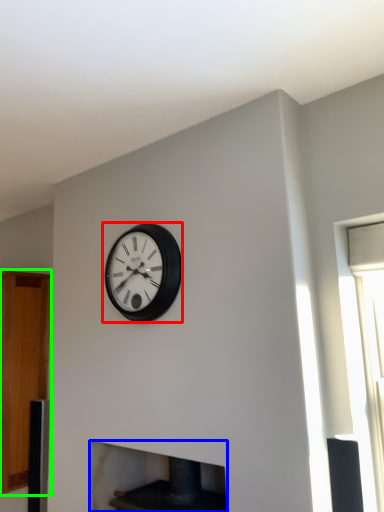
Question: Which is farther away from wall clock (highlighted by a red box)? fireplace (highlighted by a blue box) or cabinetry (highlighted by a green box)?

Choices:
 (A) fireplace
 (B) cabinetry

Answer: (B)